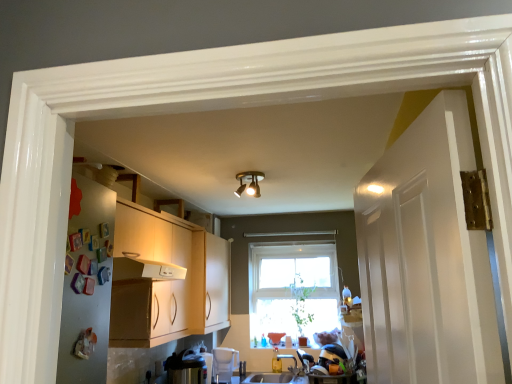
Question: Is smooth white countertop at lower center outside gold metallic light fixture at center?

Choices:
 (A) no
 (B) yes

Answer: (B)

Question: Is smooth white countertop at lower center surrounding gold metallic light fixture at center?

Choices:
 (A) yes
 (B) no

Answer: (B)

Question: Considering the relative sizes of smooth white countertop at lower center and gold metallic light fixture at center in the image provided, is smooth white countertop at lower center thinner than gold metallic light fixture at center?

Choices:
 (A) yes
 (B) no

Answer: (B)

Question: Does smooth white countertop at lower center have a smaller size compared to gold metallic light fixture at center?

Choices:
 (A) no
 (B) yes

Answer: (A)

Question: Can you confirm if smooth white countertop at lower center is shorter than gold metallic light fixture at center?

Choices:
 (A) yes
 (B) no

Answer: (A)

Question: Is smooth white countertop at lower center looking in the opposite direction of gold metallic light fixture at center?

Choices:
 (A) no
 (B) yes

Answer: (A)

Question: Is clear glass window at center at the left side of satin silver toaster at lower left, positioned as the first appliance in front-to-back order?

Choices:
 (A) no
 (B) yes

Answer: (A)

Question: Is clear glass window at center facing away from satin silver toaster at lower left, arranged as the second appliance when viewed from the right?

Choices:
 (A) no
 (B) yes

Answer: (A)

Question: Are clear glass window at center and satin silver toaster at lower left, marked as the 1th appliance in a left-to-right arrangement, making contact?

Choices:
 (A) yes
 (B) no

Answer: (B)

Question: Considering the relative sizes of clear glass window at center and satin silver toaster at lower left, positioned as the first appliance in front-to-back order, in the image provided, is clear glass window at center shorter than satin silver toaster at lower left, positioned as the first appliance in front-to-back order,?

Choices:
 (A) no
 (B) yes

Answer: (A)

Question: From the image's perspective, is clear glass window at center on top of satin silver toaster at lower left, which is the 2th appliance from back to front?

Choices:
 (A) yes
 (B) no

Answer: (A)

Question: From a real-world perspective, is clear glass window at center positioned over satin silver toaster at lower left, arranged as the second appliance when viewed from the right, based on gravity?

Choices:
 (A) yes
 (B) no

Answer: (A)

Question: Can you confirm if gold metallic light fixture at center is positioned to the left of clear glass window at center?

Choices:
 (A) yes
 (B) no

Answer: (A)